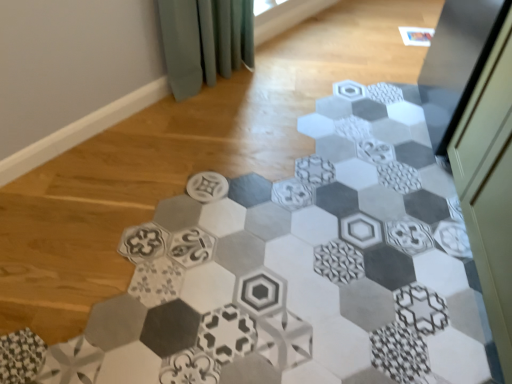
Identify the location of vacant space to the left of white glossy picture frame at upper right. (384, 38).